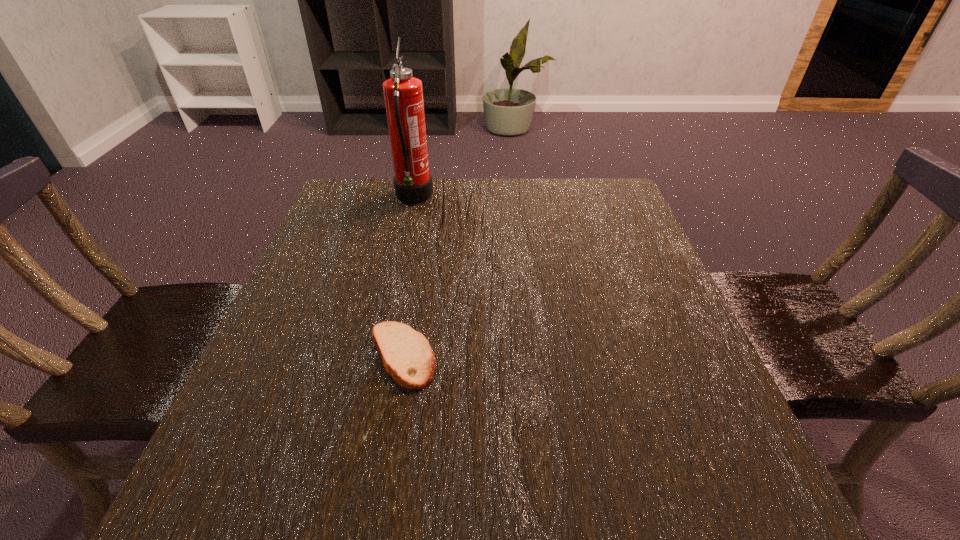
Locate an element on the screen. free space that satisfies the following two spatial constraints: 1. on the front-facing side of the fire extinguisher; 2. on the left side of the pita bread is located at coordinates (379, 356).

Find the location of a particular element. This screenshot has height=540, width=960. free space in the image that satisfies the following two spatial constraints: 1. on the front-facing side of the taller object; 2. on the left side of the pita bread is located at coordinates (379, 356).

You are a GUI agent. You are given a task and a screenshot of the screen. Output one action in this format:
    pyautogui.click(x=<x>, y=<y>)
    Task: Click on the vacant space that satisfies the following two spatial constraints: 1. on the back side of the nearer object; 2. on the front-facing side of the taller object
    
    Given the screenshot: What is the action you would take?
    pyautogui.click(x=429, y=198)

Identify the location of vacant region that satisfies the following two spatial constraints: 1. on the front-facing side of the nearer object; 2. on the left side of the farther object. This screenshot has height=540, width=960. (379, 356).

Locate an element on the screen. Image resolution: width=960 pixels, height=540 pixels. free space that satisfies the following two spatial constraints: 1. on the front-facing side of the fire extinguisher; 2. on the right side of the nearer object is located at coordinates (379, 356).

Where is `free space that satisfies the following two spatial constraints: 1. on the front-facing side of the pita bread; 2. on the right side of the taller object`? free space that satisfies the following two spatial constraints: 1. on the front-facing side of the pita bread; 2. on the right side of the taller object is located at coordinates (379, 356).

This screenshot has height=540, width=960. What are the coordinates of `free space that satisfies the following two spatial constraints: 1. on the front-facing side of the pita bread; 2. on the right side of the fire extinguisher` in the screenshot? It's located at (379, 356).

At what (x,y) coordinates should I click in order to perform the action: click on vacant space that satisfies the following two spatial constraints: 1. on the front-facing side of the fire extinguisher; 2. on the back side of the nearer object. Please return your answer as a coordinate pair (x, y). This screenshot has width=960, height=540. Looking at the image, I should click on (379, 356).